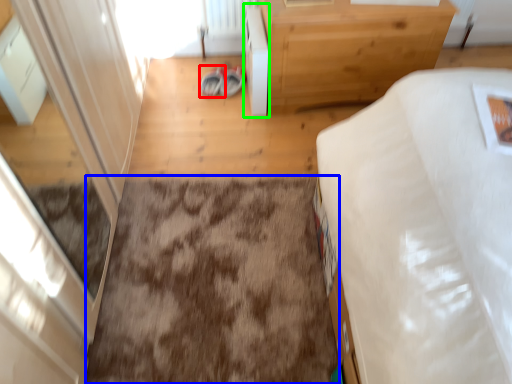
Question: Which object is positioned farthest from footwear (highlighted by a red box)? Select from dirt (highlighted by a blue box) and cabinetry (highlighted by a green box).

Choices:
 (A) dirt
 (B) cabinetry

Answer: (A)